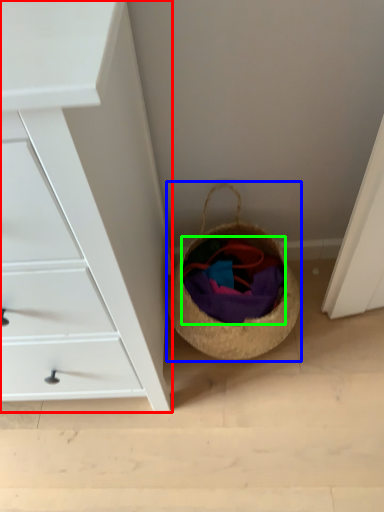
Question: Based on their relative distances, which object is farther from chest of drawers (highlighted by a red box)? Choose from basket (highlighted by a blue box) and clothing (highlighted by a green box).

Choices:
 (A) basket
 (B) clothing

Answer: (B)